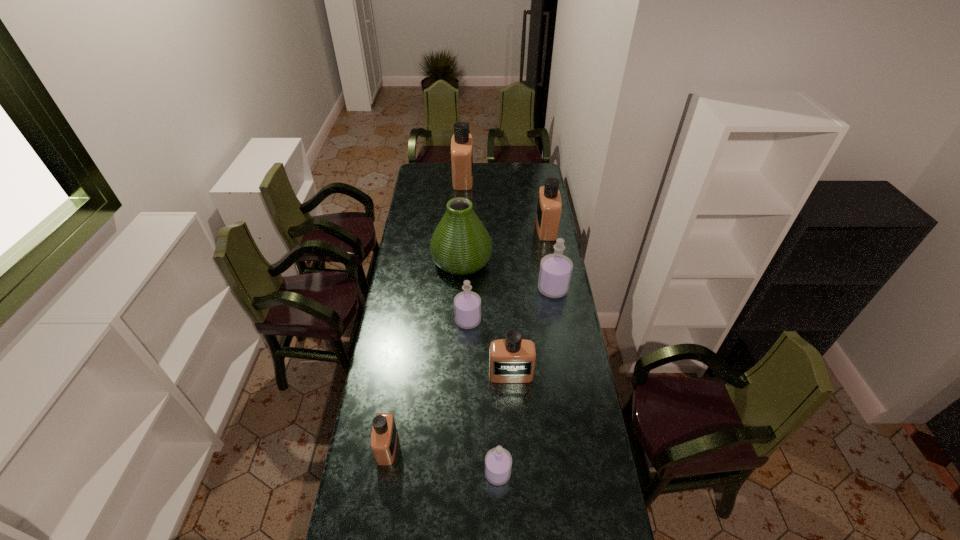
Locate an element on the screen. The width and height of the screenshot is (960, 540). the fifth farthest perfume is located at coordinates (512, 360).

Find the location of a particular element. The image size is (960, 540). the second purple perfume from left to right is located at coordinates (498, 462).

Find the location of a particular element. This screenshot has height=540, width=960. the smallest purple perfume is located at coordinates coord(498,462).

The width and height of the screenshot is (960, 540). I want to click on the leftmost perfume, so click(384, 435).

Image resolution: width=960 pixels, height=540 pixels. Identify the location of the leftmost beige perfume. (384, 435).

At what (x,y) coordinates should I click in order to perform the action: click on free spot located on the front label of the farthest object. Please return your answer as a coordinate pair (x, y). Looking at the image, I should click on (522, 179).

At what (x,y) coordinates should I click in order to perform the action: click on vacant space situated on the front of the vase. Please return your answer as a coordinate pair (x, y). Looking at the image, I should click on (459, 323).

Where is `free space located on the front label of the rightmost beige perfume`? free space located on the front label of the rightmost beige perfume is located at coordinates (486, 228).

What are the coordinates of `free location located on the front label of the rightmost beige perfume` in the screenshot? It's located at (500, 228).

At what (x,y) coordinates should I click in order to perform the action: click on vacant area located 0.400m on the front label of the rightmost beige perfume. Please return your answer as a coordinate pair (x, y). This screenshot has height=540, width=960. Looking at the image, I should click on pyautogui.click(x=464, y=228).